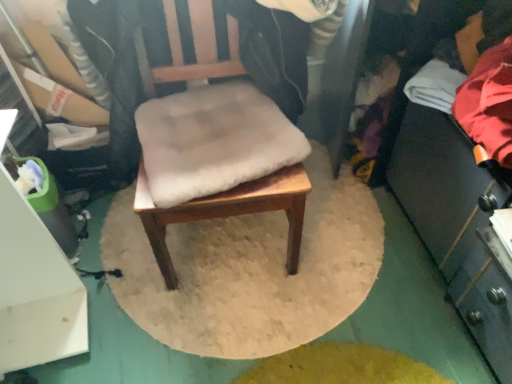
Where is `vacant space to the right of wooden chair at center`? Image resolution: width=512 pixels, height=384 pixels. vacant space to the right of wooden chair at center is located at coordinates (355, 254).